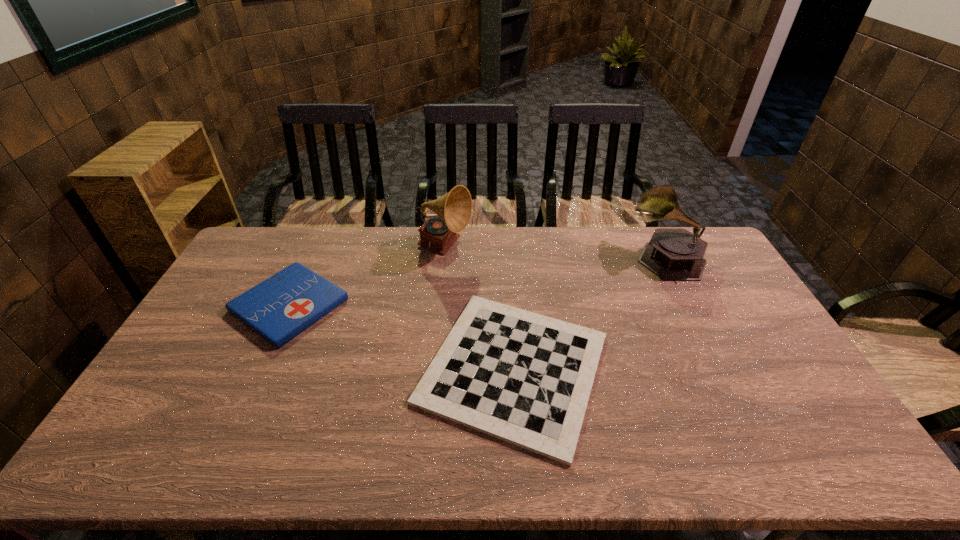
What are the coordinates of `vacant space located 0.110m on the left of the shortest object` in the screenshot? It's located at (374, 368).

Where is `object located at the near edge`? This screenshot has height=540, width=960. object located at the near edge is located at coordinates (521, 377).

Identify the location of object situated at the left edge. (278, 309).

You are a GUI agent. You are given a task and a screenshot of the screen. Output one action in this format:
    pyautogui.click(x=<x>, y=<y>)
    Task: Click on the object situated at the right edge
    
    Given the screenshot: What is the action you would take?
    coord(674,254)

At what (x,y) coordinates should I click in order to perform the action: click on object that is at the far right corner. Please return your answer as a coordinate pair (x, y). Looking at the image, I should click on [674, 254].

You are a GUI agent. You are given a task and a screenshot of the screen. Output one action in this format:
    pyautogui.click(x=<x>, y=<y>)
    Task: Click on the blank space at the far edge of the desktop
    The image size is (960, 540).
    Given the screenshot: What is the action you would take?
    pyautogui.click(x=301, y=245)

Locate an element on the screen. free location at the near edge of the desktop is located at coordinates (352, 453).

At what (x,y) coordinates should I click in order to perform the action: click on vacant region at the left edge of the desktop. Please return your answer as a coordinate pair (x, y). The width and height of the screenshot is (960, 540). Looking at the image, I should click on (252, 286).

Find the location of a particular element. The image size is (960, 540). vacant area at the right edge of the desktop is located at coordinates tap(702, 303).

Locate an element on the screen. free space at the far left corner of the desktop is located at coordinates (250, 260).